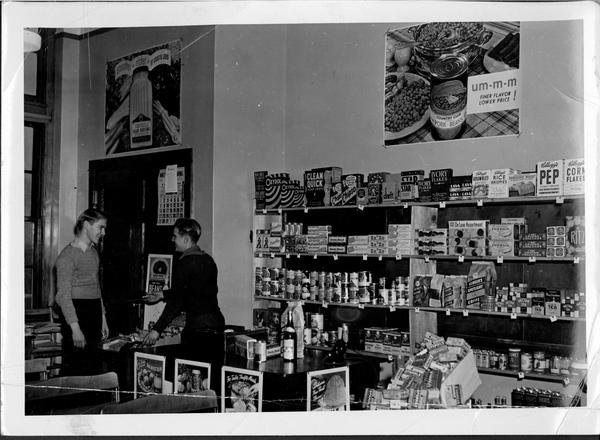
The width and height of the screenshot is (600, 440). Find the location of `wall`. wall is located at coordinates (341, 95).